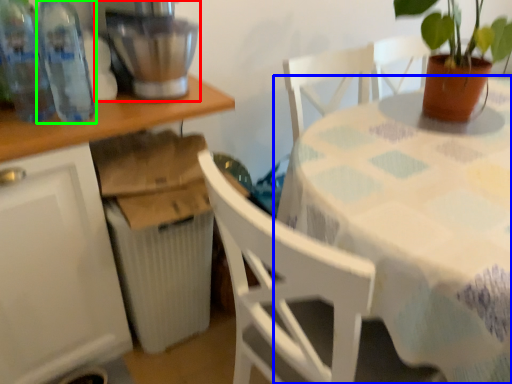
Question: Based on their relative distances, which object is nearer to mixer (highlighted by a red box)? Choose from table (highlighted by a blue box) and bottle (highlighted by a green box).

Choices:
 (A) table
 (B) bottle

Answer: (B)